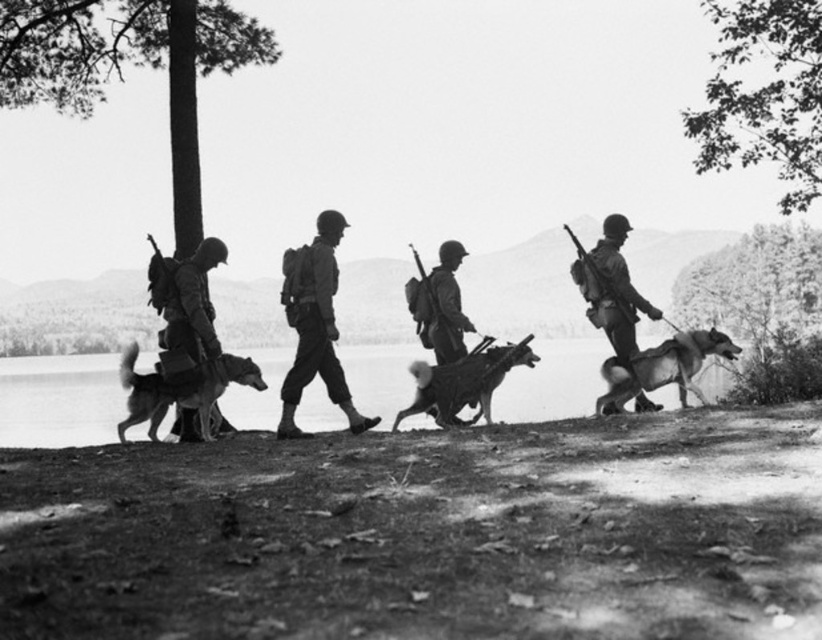
Question: Does smooth metal rifle at center have a greater width compared to polished wood rifle at upper left?

Choices:
 (A) no
 (B) yes

Answer: (B)

Question: Which point appears farthest from the camera in this image?

Choices:
 (A) (257, 410)
 (B) (211, 397)
 (C) (727, 355)
 (D) (576, 248)

Answer: (A)

Question: Which point is farther from the camera taking this photo?

Choices:
 (A) (442, 273)
 (B) (125, 387)

Answer: (A)

Question: Can you confirm if matte black uniform at center is positioned below metallic helmet at center?

Choices:
 (A) no
 (B) yes

Answer: (B)

Question: Which point is closer to the camera?

Choices:
 (A) (169, 280)
 (B) (465, 252)

Answer: (A)

Question: Is smooth water at lake center smaller than metallic helmet at center?

Choices:
 (A) no
 (B) yes

Answer: (A)